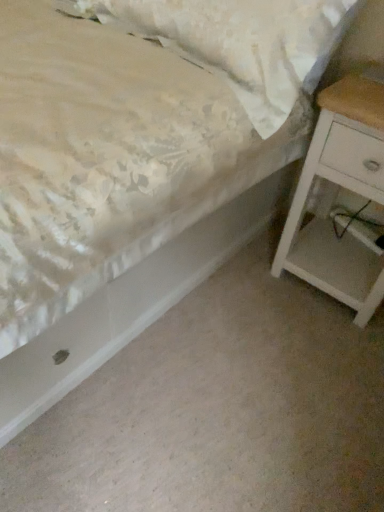
Question: Does floral fabric pillow at upper left appear on the right side of white matte nightstand at right?

Choices:
 (A) no
 (B) yes

Answer: (A)

Question: Is the position of floral fabric pillow at upper left more distant than that of white matte nightstand at right?

Choices:
 (A) no
 (B) yes

Answer: (A)

Question: Is floral fabric pillow at upper left outside of white matte nightstand at right?

Choices:
 (A) yes
 (B) no

Answer: (A)

Question: Does floral fabric pillow at upper left turn towards white matte nightstand at right?

Choices:
 (A) no
 (B) yes

Answer: (A)

Question: Does floral fabric pillow at upper left have a greater height compared to white matte nightstand at right?

Choices:
 (A) yes
 (B) no

Answer: (B)

Question: From the image's perspective, is floral fabric pillow at upper left above white matte nightstand at right?

Choices:
 (A) yes
 (B) no

Answer: (A)

Question: Considering the relative positions of white matte nightstand at right and floral fabric pillow at upper left in the image provided, is white matte nightstand at right to the right of floral fabric pillow at upper left from the viewer's perspective?

Choices:
 (A) yes
 (B) no

Answer: (A)

Question: Does white matte nightstand at right have a greater height compared to floral fabric pillow at upper left?

Choices:
 (A) no
 (B) yes

Answer: (B)

Question: Would you say white matte nightstand at right is a long distance from floral fabric pillow at upper left?

Choices:
 (A) no
 (B) yes

Answer: (A)

Question: Is white matte nightstand at right surrounding floral fabric pillow at upper left?

Choices:
 (A) yes
 (B) no

Answer: (B)

Question: From a real-world perspective, is white matte nightstand at right over floral fabric pillow at upper left?

Choices:
 (A) yes
 (B) no

Answer: (B)

Question: Does white matte nightstand at right have a larger size compared to floral fabric pillow at upper left?

Choices:
 (A) yes
 (B) no

Answer: (B)

Question: From the image's perspective, relative to floral fabric pillow at upper left, is white matte nightstand at right above or below?

Choices:
 (A) above
 (B) below

Answer: (B)